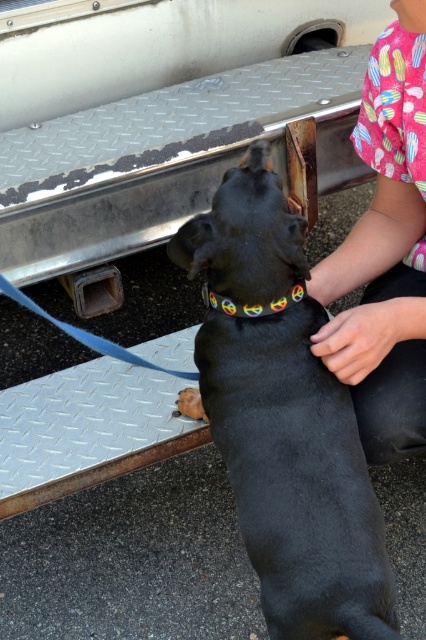
Question: Can you confirm if pink fabric shirt at upper right is thinner than rainbow fabric neckband at upper center?

Choices:
 (A) yes
 (B) no

Answer: (B)

Question: Which object appears farthest from the camera in this image?

Choices:
 (A) rainbow fabric neckband at upper center
 (B) black rubber dog at center
 (C) pink fabric shirt at upper right

Answer: (A)

Question: From the image, what is the correct spatial relationship of pink fabric shirt at upper right in relation to rainbow fabric neckband at upper center?

Choices:
 (A) below
 (B) above

Answer: (B)

Question: Which point is farther to the camera?

Choices:
 (A) pyautogui.click(x=423, y=113)
 (B) pyautogui.click(x=261, y=308)

Answer: (A)

Question: Which of the following is the closest to the observer?

Choices:
 (A) rainbow fabric neckband at upper center
 (B) black rubber dog at center
 (C) pink fabric shirt at upper right

Answer: (B)

Question: Is black rubber dog at center positioned before rainbow fabric neckband at upper center?

Choices:
 (A) no
 (B) yes

Answer: (B)